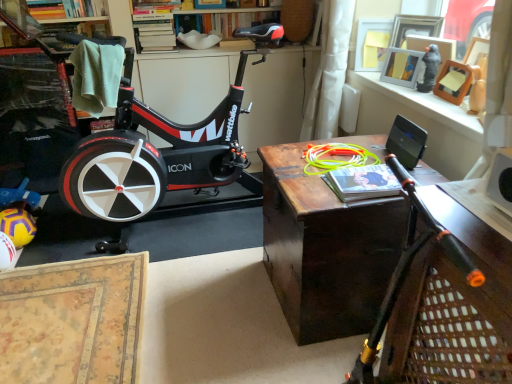
This screenshot has width=512, height=384. What do you see at coordinates (406, 142) in the screenshot?
I see `black plastic speaker at upper right` at bounding box center [406, 142].

This screenshot has height=384, width=512. Describe the element at coordinates (362, 182) in the screenshot. I see `hardcover book at center, placed as the first book when sorted from right to left` at that location.

Describe the element at coordinates (425, 105) in the screenshot. Image resolution: width=512 pixels, height=384 pixels. I see `wooden frame at upper right` at that location.

Where is `black plastic speaker at upper right`? Image resolution: width=512 pixels, height=384 pixels. black plastic speaker at upper right is located at coordinates (406, 142).

Is black plastic speaker at upper right beside black matte stationary bicycle at center?

No, black plastic speaker at upper right is not beside black matte stationary bicycle at center.

Is black plastic speaker at upper right aimed at black matte stationary bicycle at center?

No, black plastic speaker at upper right does not turn towards black matte stationary bicycle at center.

Is black plastic speaker at upper right shorter than black matte stationary bicycle at center?

Indeed, black plastic speaker at upper right has a lesser height compared to black matte stationary bicycle at center.

Is wooden bookshelf at upper center directly adjacent to hardcover book at upper left, which is the second book in right-to-left order?

No.

Is point (160, 11) farther from viewer compared to point (49, 16)?

Yes, point (160, 11) is farther from viewer.

Does wooden bookshelf at upper center contain hardcover book at upper left, which is the second book in right-to-left order?

No, hardcover book at upper left, which is the second book in right-to-left order, is not a part of wooden bookshelf at upper center.

Considering the sizes of wooden bookshelf at upper center and hardcover book at upper left, positioned as the 1th book in back-to-front order, in the image, is wooden bookshelf at upper center bigger or smaller than hardcover book at upper left, positioned as the 1th book in back-to-front order,?

Clearly, wooden bookshelf at upper center is larger in size than hardcover book at upper left, positioned as the 1th book in back-to-front order.

Which object is positioned more to the left, wooden frame at upper right or black plastic speaker at upper right?

Positioned to the left is black plastic speaker at upper right.

Is point (451, 105) positioned behind point (401, 147)?

Yes, it is.

Considering their positions, is wooden frame at upper right located in front of or behind black plastic speaker at upper right?

In the image, wooden frame at upper right appears in front of black plastic speaker at upper right.

Is black matte stationary bicycle at center situated inside dark wood table at center or outside?

The correct answer is: outside.

Based on the photo, measure the distance between black matte stationary bicycle at center and dark wood table at center.

A distance of 33.19 inches exists between black matte stationary bicycle at center and dark wood table at center.

Which of these two, black matte stationary bicycle at center or dark wood table at center, is wider?

dark wood table at center.

Is black matte stationary bicycle at center oriented away from dark wood table at center?

No, dark wood table at center is not at the back of black matte stationary bicycle at center.

From a real-world perspective, which object stands above the other?

wooden frame at upper right, from a real-world perspective.

Relative to wooden frame at upper right, is dark wood table at center in front or behind?

Clearly, dark wood table at center is in front of wooden frame at upper right.

In order to click on window sill lying behind the dark wood table at center in this screenshot , I will do `click(425, 105)`.

Considering the sizes of dark wood table at center and wooden frame at upper right in the image, is dark wood table at center bigger or smaller than wooden frame at upper right?

Considering their sizes, dark wood table at center takes up more space than wooden frame at upper right.

From the image's perspective, is hardcover book at upper left, positioned as the 1th book in back-to-front order, located beneath hardcover book at center, the 1th book from the front?

No.

Is hardcover book at upper left, positioned as the 1th book in back-to-front order, bigger than hardcover book at center, placed as the first book when sorted from right to left?

Yes.

Are hardcover book at upper left, acting as the second book starting from the front, and hardcover book at center, the 1th book from the front, beside each other?

hardcover book at upper left, acting as the second book starting from the front, and hardcover book at center, the 1th book from the front, are not in contact.

Can you confirm if hardcover book at upper left, which is counted as the 1th book, starting from the left, is thinner than hardcover book at center, placed as the first book when sorted from right to left?

Yes, hardcover book at upper left, which is counted as the 1th book, starting from the left, is thinner than hardcover book at center, placed as the first book when sorted from right to left.

From the image's perspective, which is below, black plastic speaker at upper right or wooden frame at upper right?

From the image's view, black plastic speaker at upper right is below.

Does black plastic speaker at upper right turn towards wooden frame at upper right?

No, black plastic speaker at upper right is not turned towards wooden frame at upper right.

From a real-world perspective, which is physically below, black plastic speaker at upper right or wooden frame at upper right?

black plastic speaker at upper right is physically lower.

Considering the relative sizes of black plastic speaker at upper right and wooden frame at upper right in the image provided, is black plastic speaker at upper right shorter than wooden frame at upper right?

No, black plastic speaker at upper right is not shorter than wooden frame at upper right.

This screenshot has height=384, width=512. Find the location of `speaker that is on the right side of black matte stationary bicycle at center`. speaker that is on the right side of black matte stationary bicycle at center is located at coordinates (406, 142).

The image size is (512, 384). I want to click on book located above the wooden bookshelf at upper center (from the image's perspective), so click(65, 8).

From the picture: Considering their positions, is wooden bookshelf at upper center positioned closer to hardcover book at upper left, acting as the second book starting from the front, than black plastic speaker at upper right?

wooden bookshelf at upper center is closer to hardcover book at upper left, acting as the second book starting from the front.

Which object lies further to the anchor point hardcover book at upper left, which is the second book in right-to-left order, dark wood table at center or black matte stationary bicycle at center?

dark wood table at center is further to hardcover book at upper left, which is the second book in right-to-left order.

Looking at the image, which one is located closer to wooden bookshelf at upper center, dark wood table at center or black matte stationary bicycle at center?

The object closer to wooden bookshelf at upper center is black matte stationary bicycle at center.

Based on their spatial positions, is wooden frame at upper right or black matte stationary bicycle at center closer to dark wood table at center?

wooden frame at upper right.

Which object lies nearer to the anchor point wooden bookshelf at upper center, dark wood table at center or hardcover book at upper left, which is the 1th book in top-to-bottom order?

hardcover book at upper left, which is the 1th book in top-to-bottom order.

When comparing their distances from wooden bookshelf at upper center, does hardcover book at center, placed as the first book when sorted from right to left, or dark wood table at center seem closer?

dark wood table at center is positioned closer to the anchor wooden bookshelf at upper center.

Estimate the real-world distances between objects in this image. Which object is closer to hardcover book at center, the 1th book from the front, black plastic speaker at upper right or hardcover book at upper left, which is the 1th book in top-to-bottom order?

black plastic speaker at upper right lies closer to hardcover book at center, the 1th book from the front, than the other object.

Considering their positions, is wooden frame at upper right positioned further to wooden bookshelf at upper center than hardcover book at upper left, positioned as the 1th book in back-to-front order?

Based on the image, wooden frame at upper right appears to be further to wooden bookshelf at upper center.

Identify the location of book between black plastic speaker at upper right and dark wood table at center in the vertical direction. (362, 182).

Find the location of a particular element. The image size is (512, 384). stationary bicycle between hardcover book at upper left, which is the second book in right-to-left order, and hardcover book at center, the second book when ordered from top to bottom, from left to right is located at coordinates (160, 150).

Find the location of a particular element. This screenshot has height=384, width=512. book situated between black matte stationary bicycle at center and wooden frame at upper right from left to right is located at coordinates (362, 182).

What are the coordinates of `table situated between black matte stationary bicycle at center and black plastic speaker at upper right from left to right` in the screenshot? It's located at (325, 249).